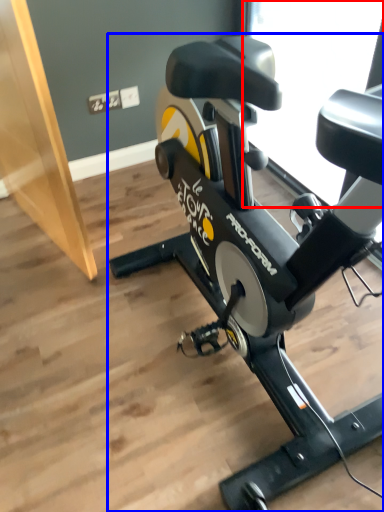
Question: Among these objects, which one is farthest to the camera, window screen (highlighted by a red box) or stationary bicycle (highlighted by a blue box)?

Choices:
 (A) window screen
 (B) stationary bicycle

Answer: (A)